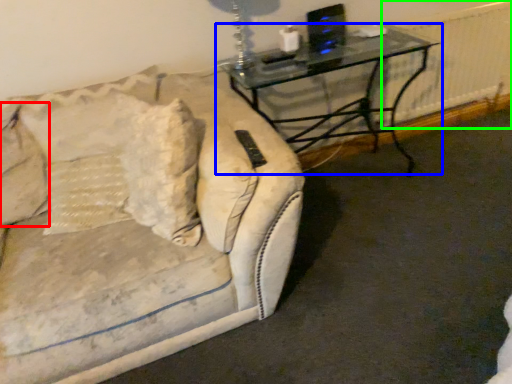
Question: Which is nearer to the pillow (highlighted by a red box)? table (highlighted by a blue box) or radiator (highlighted by a green box).

Choices:
 (A) table
 (B) radiator

Answer: (A)